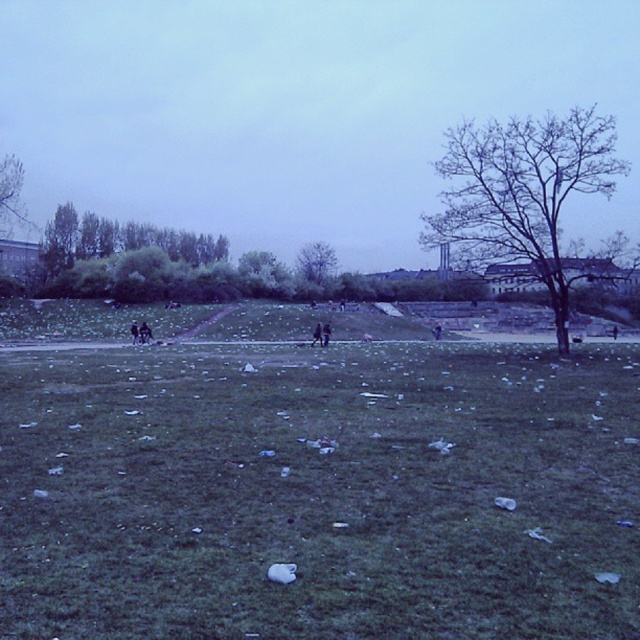
Does bare branches at upper right appear on the right side of green leafy tree at left?

Yes, bare branches at upper right is to the right of green leafy tree at left.

In order to click on bare branches at upper right in this screenshot , I will do [522, 193].

Identify the location of bare branches at upper right. The width and height of the screenshot is (640, 640). (522, 193).

Identify the location of bare branches at upper right. (522, 193).

Is green grass at center above green leafy tree at center?

No, green grass at center is not above green leafy tree at center.

Does green grass at center appear on the right side of green leafy tree at center?

No, green grass at center is not to the right of green leafy tree at center.

Which is behind, point (381, 468) or point (326, 252)?

Positioned behind is point (326, 252).

You are a GUI agent. You are given a task and a screenshot of the screen. Output one action in this format:
    pyautogui.click(x=<x>, y=<y>)
    Task: Click on the green grass at center
    The image size is (640, 640).
    Given the screenshot: What is the action you would take?
    pyautogui.click(x=321, y=493)

Can you confirm if bare branches at upper right is thinner than green leafy tree at center?

In fact, bare branches at upper right might be wider than green leafy tree at center.

Which is more to the left, bare branches at upper right or green leafy tree at center?

green leafy tree at center is more to the left.

Who is more distant from viewer, (484, 157) or (314, 243)?

Positioned behind is point (314, 243).

At what (x,y) coordinates should I click in order to perform the action: click on bare branches at upper right. Please return your answer as a coordinate pair (x, y). This screenshot has height=640, width=640. Looking at the image, I should click on (522, 193).